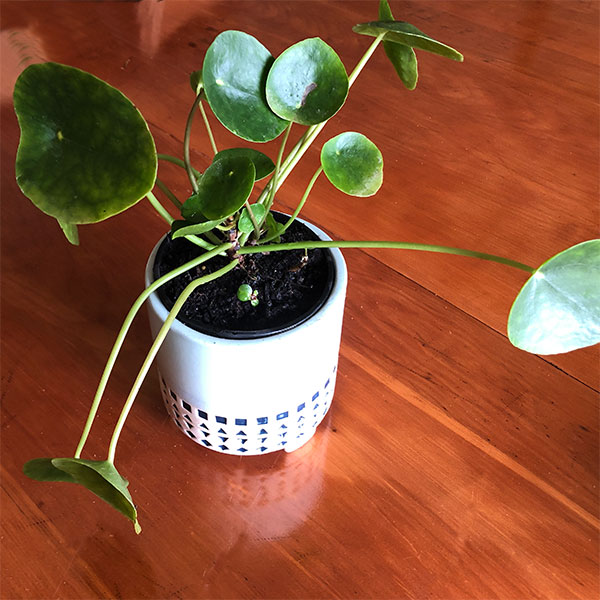
In order to click on wood floor in this screenshot , I will do `click(424, 451)`, `click(471, 380)`.